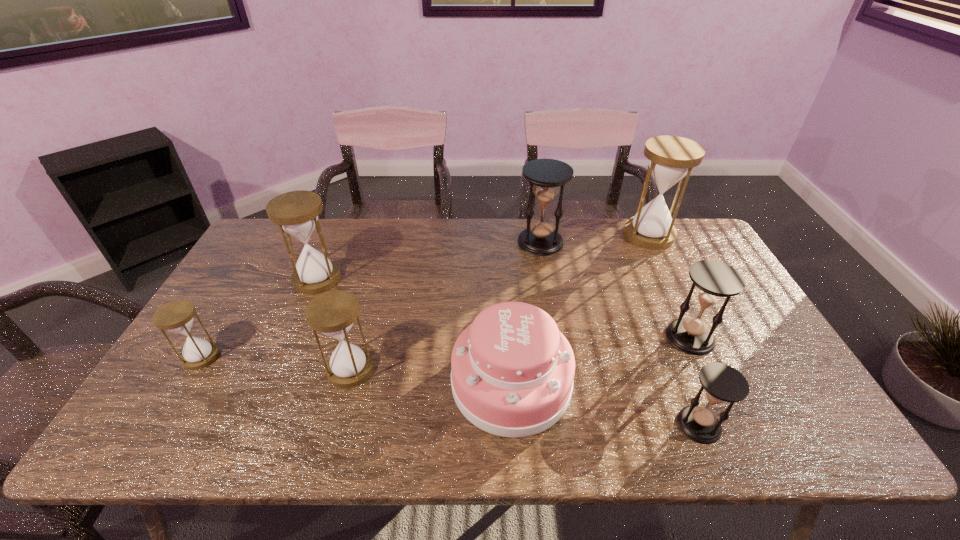
Identify the location of the leftmost object. The height and width of the screenshot is (540, 960). 177,316.

At what (x,y) coordinates should I click in order to perform the action: click on the leftmost hourglass. Please return your answer as a coordinate pair (x, y). Looking at the image, I should click on (177, 316).

Locate an element on the screen. the smallest black hourglass is located at coordinates (722, 383).

At what (x,y) coordinates should I click in order to perform the action: click on the nearest black hourglass. Please return your answer as a coordinate pair (x, y). This screenshot has width=960, height=540. Looking at the image, I should click on (722, 383).

You are a GUI agent. You are given a task and a screenshot of the screen. Output one action in this format:
    pyautogui.click(x=<x>, y=<y>)
    Task: Click on the free point located 0.360m on the front of the rightmost white hourglass
    This screenshot has width=960, height=540.
    Given the screenshot: What is the action you would take?
    pyautogui.click(x=696, y=330)

Where is `free point located 0.300m on the right of the leftmost black hourglass`? free point located 0.300m on the right of the leftmost black hourglass is located at coordinates (651, 242).

At what (x,y) coordinates should I click in order to perform the action: click on vacant space located on the right of the second farthest white hourglass. Please return your answer as a coordinate pair (x, y). The height and width of the screenshot is (540, 960). Looking at the image, I should click on (418, 279).

Find the location of a particular element. Image resolution: width=960 pixels, height=540 pixels. free region located on the back of the second smallest black hourglass is located at coordinates coord(646,245).

Where is `vacant space located on the back of the fifth hourglass from right to left`? The image size is (960, 540). vacant space located on the back of the fifth hourglass from right to left is located at coordinates (359, 337).

This screenshot has height=540, width=960. What are the coordinates of `free space located 0.390m on the back of the pink birthday cake` in the screenshot? It's located at (502, 249).